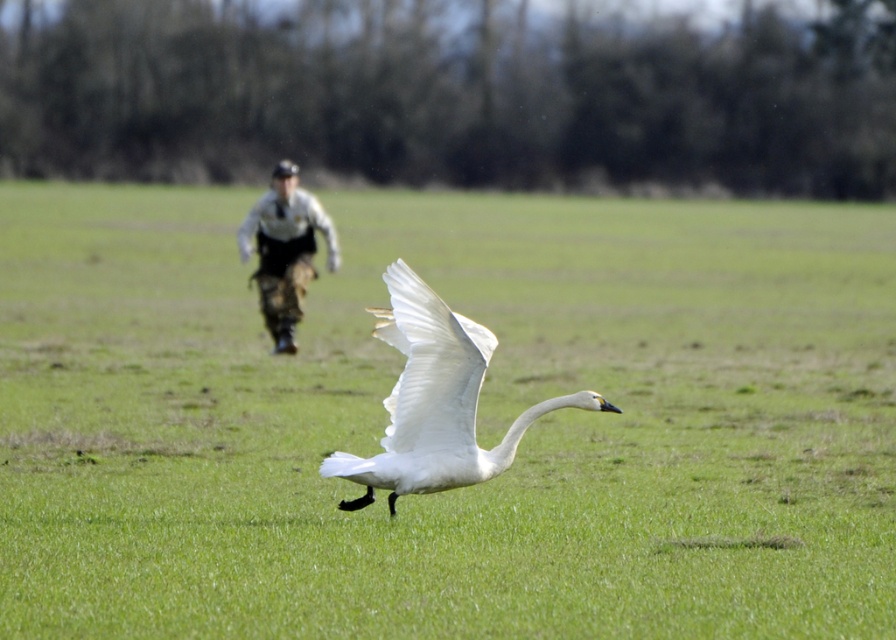
Question: Can you confirm if green grassy field at center is thinner than white glossy swan at center?

Choices:
 (A) no
 (B) yes

Answer: (A)

Question: Which point is farther from the camera taking this photo?

Choices:
 (A) (416, 330)
 (B) (266, 211)
 (C) (714, 320)

Answer: (C)

Question: Is the position of white glossy swan at center less distant than that of camouflage pants at center?

Choices:
 (A) no
 (B) yes

Answer: (B)

Question: Is green grassy field at center bigger than camouflage pants at center?

Choices:
 (A) yes
 (B) no

Answer: (A)

Question: Estimate the real-world distances between objects in this image. Which object is closer to the camouflage pants at center?

Choices:
 (A) green grassy field at center
 (B) white glossy swan at center

Answer: (A)

Question: Considering the real-world distances, which object is closest to the camouflage pants at center?

Choices:
 (A) white glossy swan at center
 (B) green grassy field at center

Answer: (B)